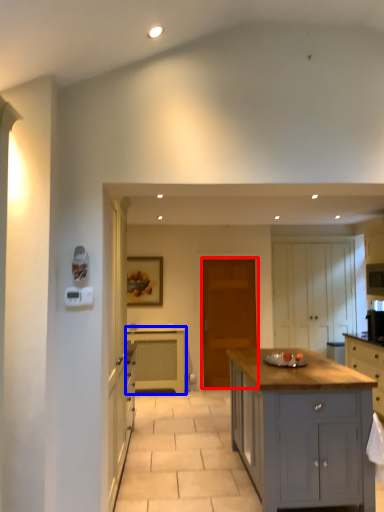
Question: Which object is closer to the camera taking this photo, door (highlighted by a red box) or cabinetry (highlighted by a blue box)?

Choices:
 (A) door
 (B) cabinetry

Answer: (B)